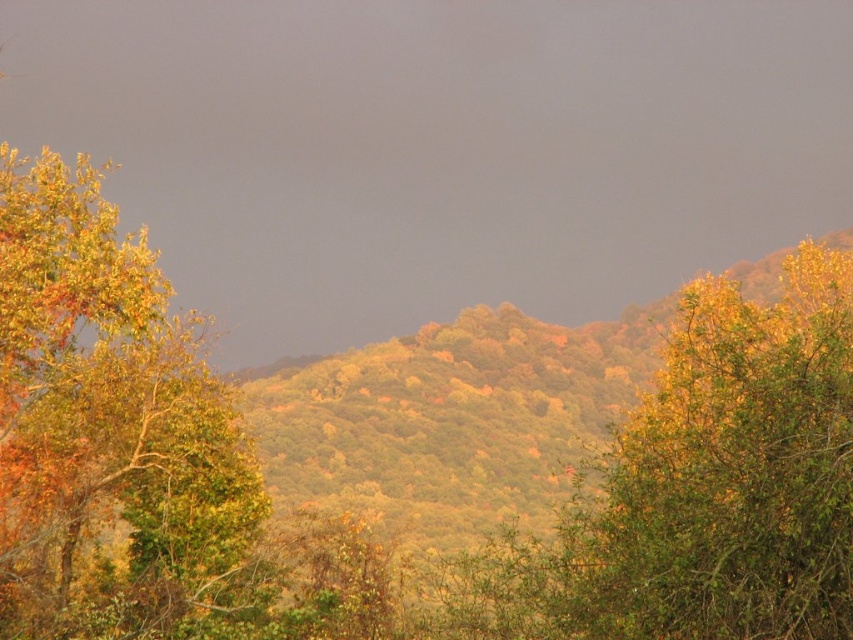
You are standing in the autumn forest and want to take a photo of both the green leafy tree at center and the golden foliage tree at left. Which tree should you focus on first to ensure both are in the frame?

You should focus on the green leafy tree at center first since it is closer to you than the golden foliage tree at left, allowing both to be captured in the frame.